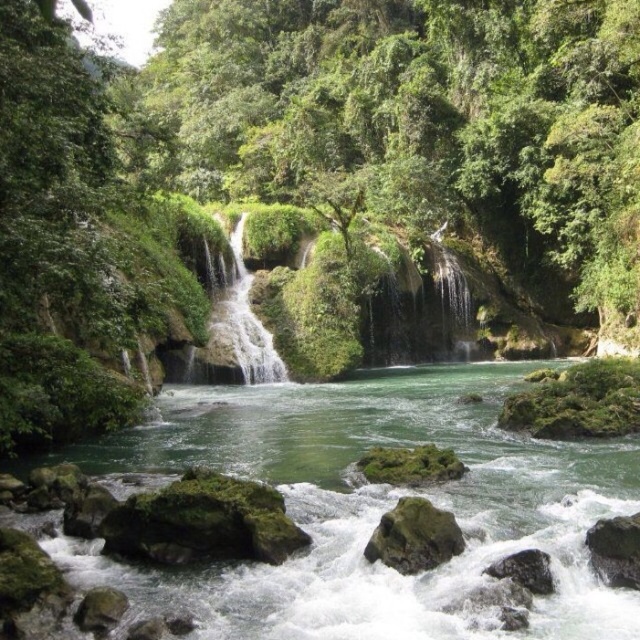
Question: Can you confirm if gray rough rock at lower right is smaller than green mossy rock at lower left?

Choices:
 (A) yes
 (B) no

Answer: (B)

Question: Which of the following is the closest to the observer?

Choices:
 (A) (444, 282)
 (B) (632, 564)

Answer: (B)

Question: Among these objects, which one is farthest from the camera?

Choices:
 (A) gray rough rock at lower right
 (B) green mossy waterfall at center
 (C) clear water at center
 (D) green mossy rocks at center

Answer: (B)

Question: Is green mossy waterfall at center bigger than green mossy rock at lower left?

Choices:
 (A) no
 (B) yes

Answer: (B)

Question: Which point is closer to the camera?

Choices:
 (A) (337, 628)
 (B) (464, 541)
 (C) (237, 269)
 (D) (104, 588)

Answer: (A)

Question: Does green mossy rock at lower right appear over green mossy rock at lower left?

Choices:
 (A) no
 (B) yes

Answer: (B)